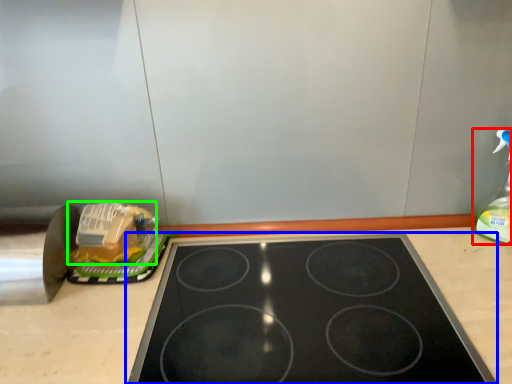
Question: Which object is the farthest from bottle (highlighted by a red box)? Choose among these: gas stove (highlighted by a blue box) or food (highlighted by a green box).

Choices:
 (A) gas stove
 (B) food

Answer: (B)